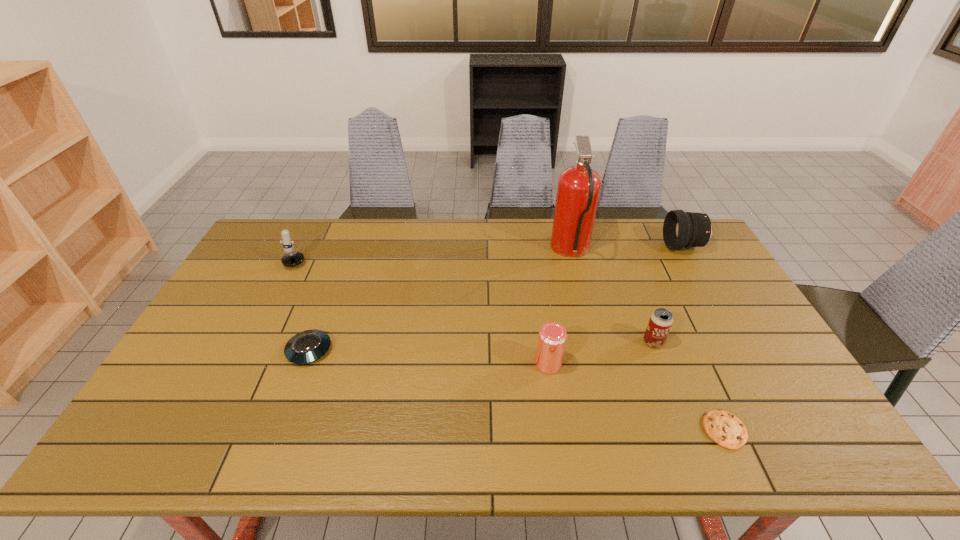
Find the location of `cookie`. cookie is located at coordinates (724, 428).

At what (x,y) coordinates should I click in order to perform the action: click on the sixth object from left to right. Please return your answer as a coordinate pair (x, y). The height and width of the screenshot is (540, 960). Looking at the image, I should click on (724, 428).

At what (x,y) coordinates should I click in order to perform the action: click on vacant region located with the handle and nozzle on the tallest object. Please return your answer as a coordinate pair (x, y). The height and width of the screenshot is (540, 960). Looking at the image, I should click on (458, 251).

This screenshot has width=960, height=540. Find the location of `vacant space located 0.120m with the handle and nozzle on the tallest object`. vacant space located 0.120m with the handle and nozzle on the tallest object is located at coordinates (517, 251).

Find the location of a particular element. free space located with the handle and nozzle on the tallest object is located at coordinates (506, 251).

At what (x,y) coordinates should I click in order to perform the action: click on blank space located 0.320m at the front element of the telephoto lens. Please return your answer as a coordinate pair (x, y). Looking at the image, I should click on (575, 246).

Identify the location of free spot located at the front element of the telephoto lens. This screenshot has width=960, height=540. (606, 246).

Where is `blank space located at the front element of the telephoto lens`? blank space located at the front element of the telephoto lens is located at coordinates (617, 246).

You are a GUI agent. You are given a task and a screenshot of the screen. Output one action in this format:
    pyautogui.click(x=<x>, y=<y>)
    Task: Click on the vacant space located 0.300m on the right of the microphone
    The image size is (960, 540).
    Given the screenshot: What is the action you would take?
    pyautogui.click(x=396, y=255)

Find the location of `free space located 0.270m on the right of the left beer can`. free space located 0.270m on the right of the left beer can is located at coordinates (662, 364).